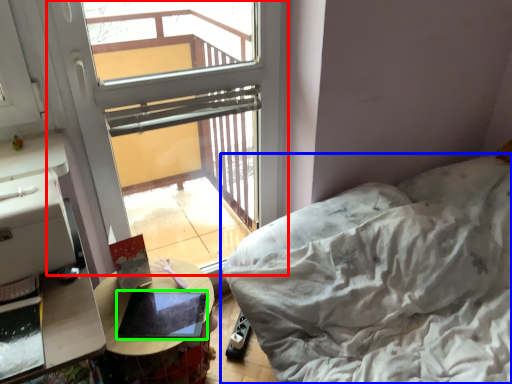
Question: Estimate the real-world distances between objects in this image. Which object is closer to window (highlighted by a red box), furniture (highlighted by a blue box) or laptop (highlighted by a green box)?

Choices:
 (A) furniture
 (B) laptop

Answer: (B)